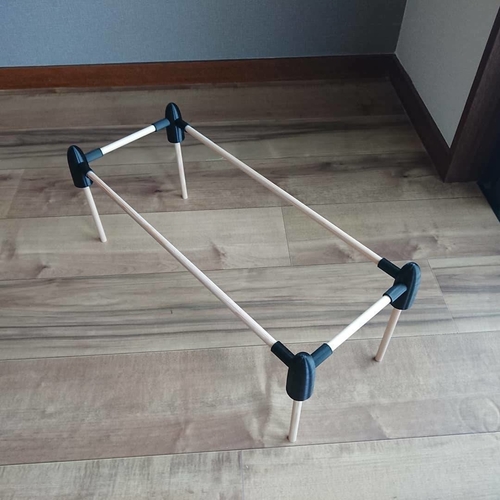
I want to click on blue wall, so click(310, 30).